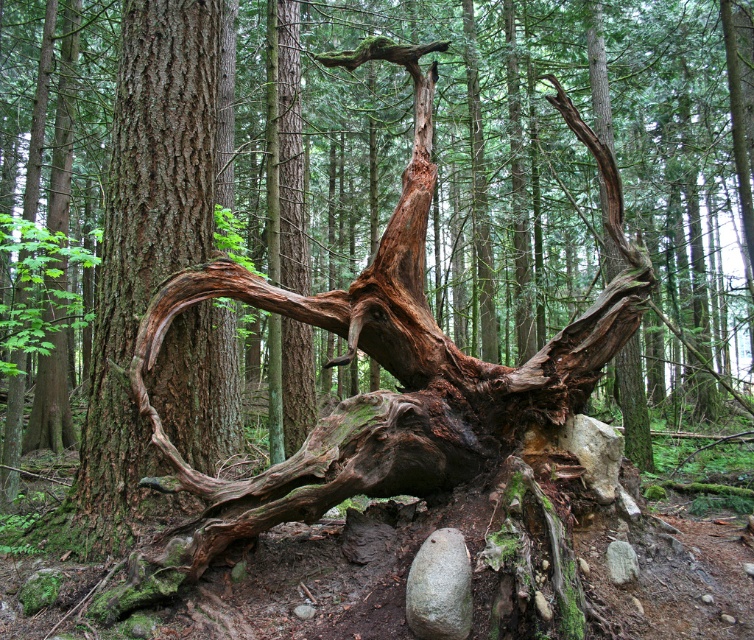
Question: Which object appears farthest from the camera in this image?

Choices:
 (A) gray rough rock at lower center
 (B) rough bark tree trunk at center

Answer: (B)

Question: Does rough bark tree trunk at center appear under gray rough rock at lower center?

Choices:
 (A) no
 (B) yes

Answer: (A)

Question: Can you confirm if rough bark tree trunk at center is positioned to the left of gray rough rock at lower center?

Choices:
 (A) yes
 (B) no

Answer: (A)

Question: Which of the following is the farthest from the observer?

Choices:
 (A) rough bark tree trunk at center
 (B) gray rough rock at lower center

Answer: (A)

Question: Where is rough bark tree trunk at center located in relation to gray rough rock at lower center in the image?

Choices:
 (A) above
 (B) below

Answer: (A)